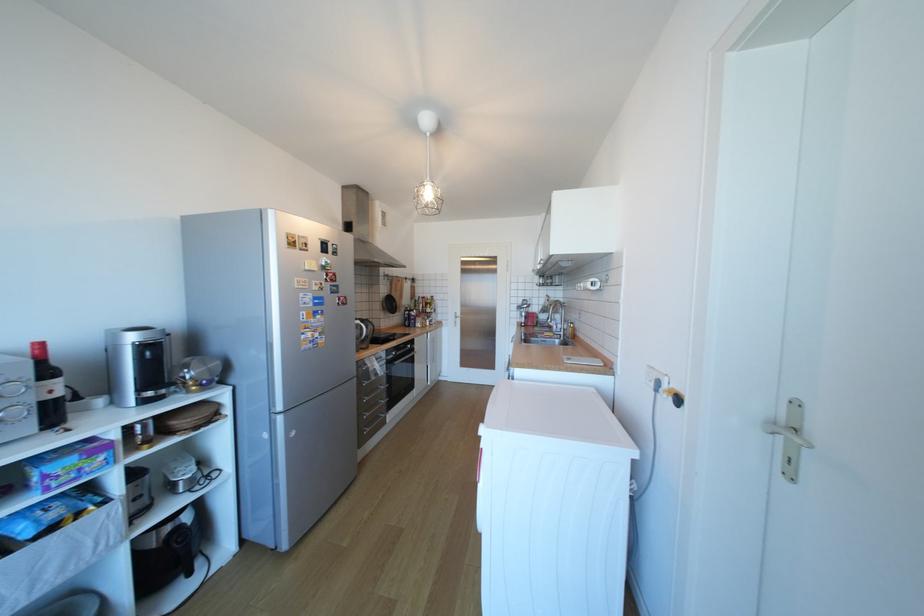
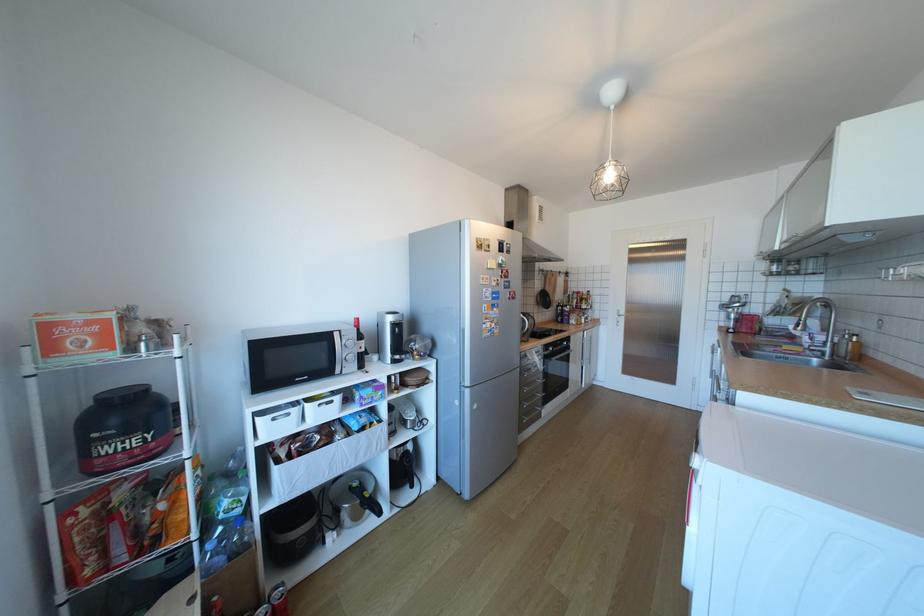
Where in the second image is the point corresponding to (x=468, y=314) from the first image?

(631, 312)